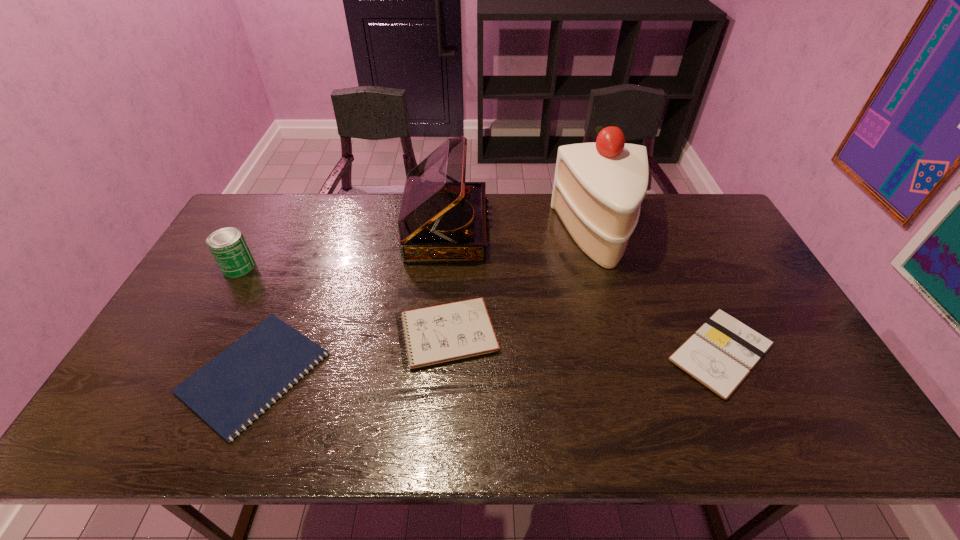
Where is `vacant region located 0.110m on the front-facing side of the fifth shortest object`? The height and width of the screenshot is (540, 960). vacant region located 0.110m on the front-facing side of the fifth shortest object is located at coordinates point(521,229).

Identify the location of free location located on the right of the fourth shortest object. (289, 267).

This screenshot has width=960, height=540. Identify the location of vacant space located on the left of the third shortest object. (319, 334).

At what (x,y) coordinates should I click in order to perform the action: click on free location located 0.280m on the left of the second shortest notepad. Please return your answer as a coordinate pair (x, y). Looking at the image, I should click on (557, 353).

The width and height of the screenshot is (960, 540). I want to click on blank space located on the right of the shortest object, so click(464, 373).

The width and height of the screenshot is (960, 540). I want to click on cake at the far edge, so click(598, 188).

Where is `record player that is at the far edge`? record player that is at the far edge is located at coordinates (442, 218).

Image resolution: width=960 pixels, height=540 pixels. I want to click on object positioned at the near edge, so click(259, 368).

Locate an element on the screen. The width and height of the screenshot is (960, 540). can located at the left edge is located at coordinates (227, 245).

The image size is (960, 540). What are the coordinates of `notepad situated at the left edge` in the screenshot? It's located at (259, 368).